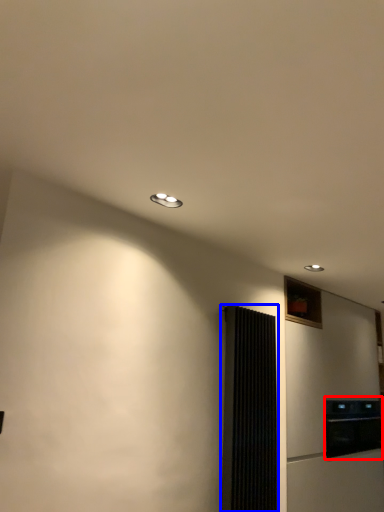
Question: Among these objects, which one is farthest to the camera, appliance (highlighted by a red box) or screen door (highlighted by a blue box)?

Choices:
 (A) appliance
 (B) screen door

Answer: (A)